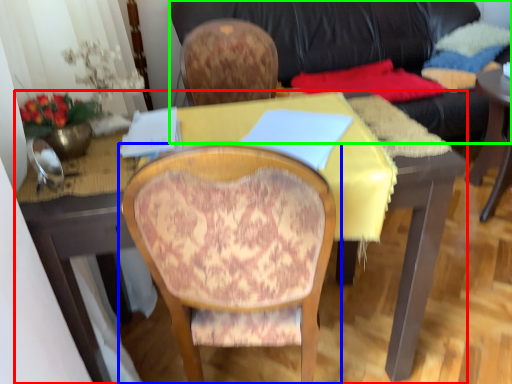
Question: Which is nearer to the desk (highlighted by a red box)? chair (highlighted by a blue box) or studio couch (highlighted by a green box).

Choices:
 (A) chair
 (B) studio couch

Answer: (A)